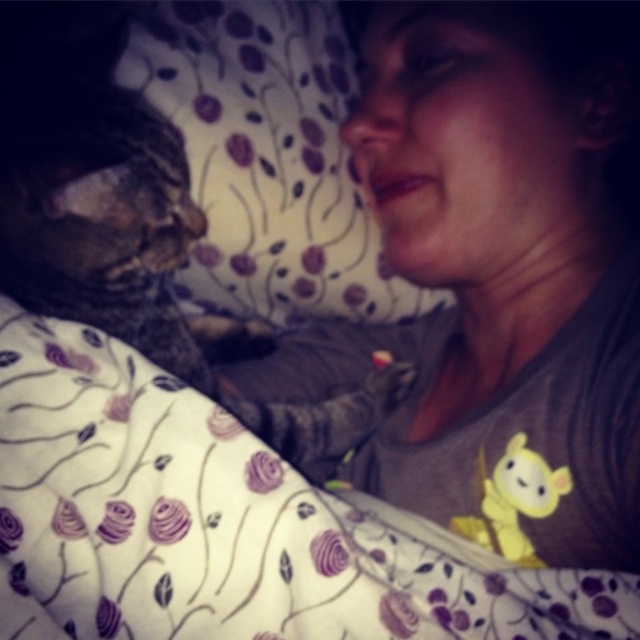
Question: Does fluffy white blanket at lower left appear over tabby fur cat at left?

Choices:
 (A) yes
 (B) no

Answer: (B)

Question: Among these points, which one is nearest to the camera?

Choices:
 (A) (540, 467)
 (B) (324, 275)
 (C) (193, 353)

Answer: (A)

Question: Based on their relative distances, which object is farther from the tabby fur cat at left?

Choices:
 (A) yellow plush toy at center
 (B) fluffy fabric pillow at upper left

Answer: (A)

Question: Does fluffy white blanket at lower left have a smaller size compared to yellow plush toy at center?

Choices:
 (A) yes
 (B) no

Answer: (B)

Question: Can you confirm if fluffy white blanket at lower left is wider than yellow plush toy at center?

Choices:
 (A) no
 (B) yes

Answer: (B)

Question: Which is nearer to the yellow plush toy at center?

Choices:
 (A) fluffy fabric pillow at upper left
 (B) tabby fur cat at left

Answer: (B)